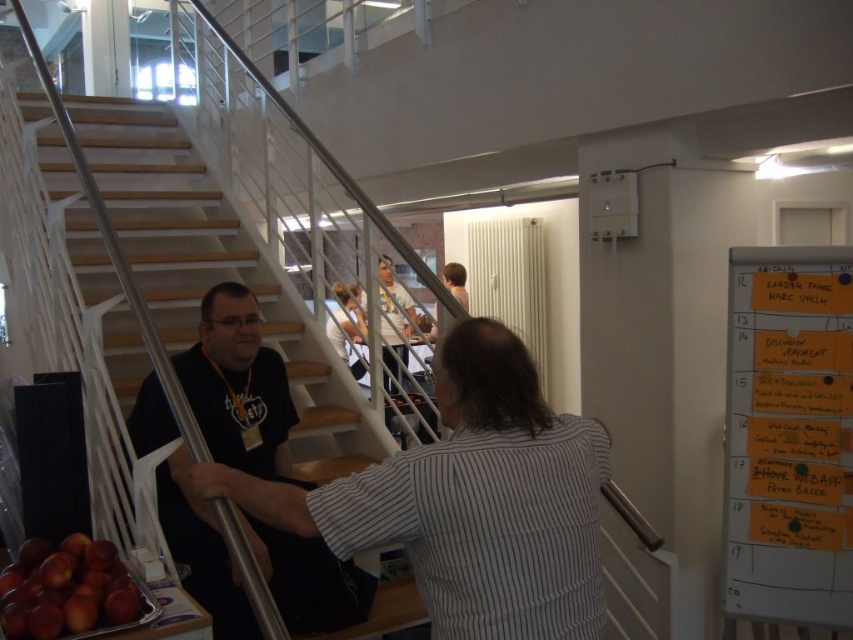
Does point (387, 509) come closer to viewer compared to point (358, 388)?

Yes.

Looking at this image, does striped cotton shirt at center come in front of wooden stairs at lower left?

Yes, striped cotton shirt at center is closer to the viewer.

What do you see at coordinates (469, 500) in the screenshot? The height and width of the screenshot is (640, 853). I see `striped cotton shirt at center` at bounding box center [469, 500].

This screenshot has height=640, width=853. In order to click on striped cotton shirt at center in this screenshot , I will do `click(469, 500)`.

Does matte black shirt at left lie behind red matte apples at lower left?

Yes, it is behind red matte apples at lower left.

Is point (172, 461) farther from camera compared to point (32, 548)?

Yes, point (172, 461) is behind point (32, 548).

Does point (241, 602) lie behind point (108, 593)?

That is True.

The width and height of the screenshot is (853, 640). In order to click on matte black shirt at left in this screenshot , I will do pyautogui.click(x=236, y=385).

Measure the distance from orange paper notes at right to red matte apples at lower left.

They are 2.20 meters apart.

Is point (784, 321) behind point (38, 541)?

Yes, it is behind point (38, 541).

Which is behind, point (730, 314) or point (82, 612)?

Point (730, 314)

I want to click on orange paper notes at right, so click(788, 435).